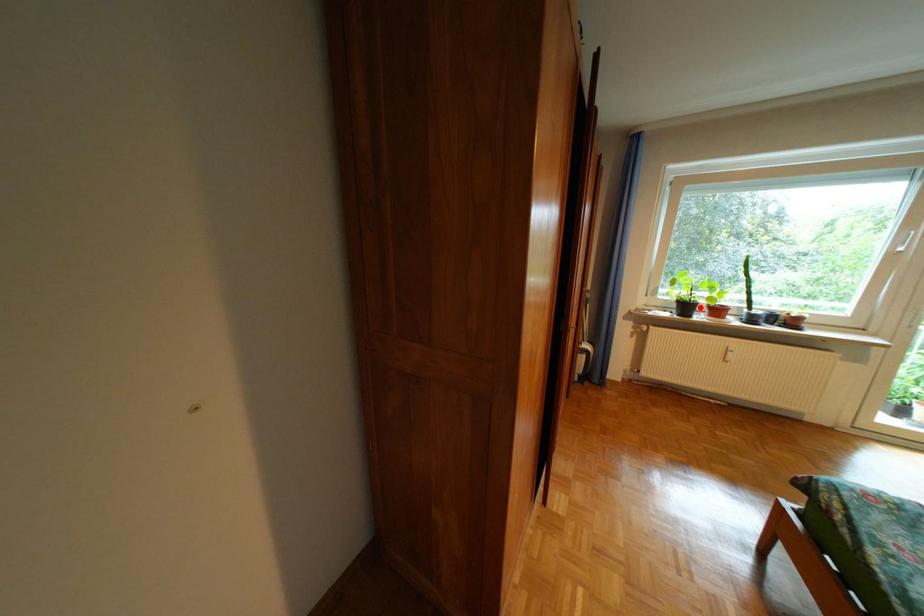
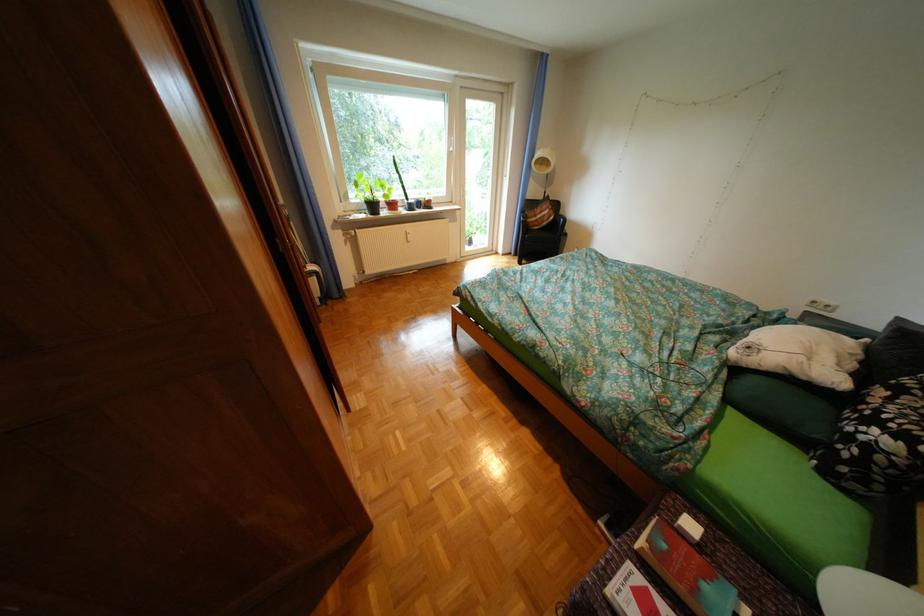
Question: I am providing you with two images of the same scene from different viewpoints. Given a red point in image1, look at the same physical point in image2. Is it:

Choices:
 (A) Closer to the viewpoint
 (B) Farther from the viewpoint

Answer: (A)